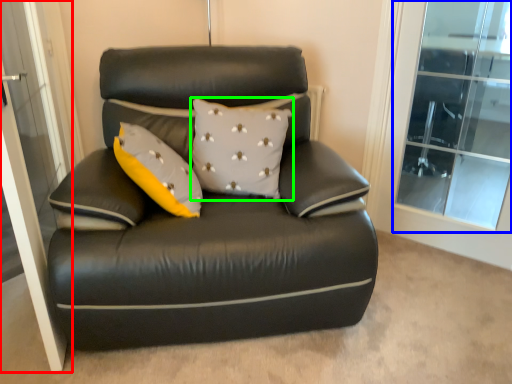
Question: Based on their relative distances, which object is nearer to screen door (highlighted by a red box)? Choose from window (highlighted by a blue box) and pillow (highlighted by a green box).

Choices:
 (A) window
 (B) pillow

Answer: (B)